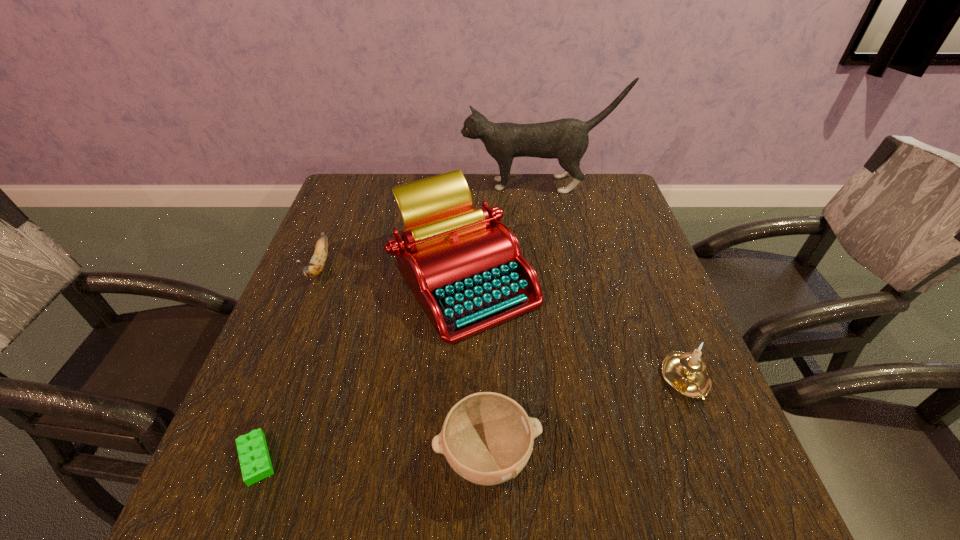
I want to click on Lego present at the left edge, so click(253, 453).

The image size is (960, 540). Identify the location of cat present at the right edge. (567, 140).

The height and width of the screenshot is (540, 960). I want to click on candle holder positioned at the right edge, so click(686, 372).

At what (x,y) coordinates should I click in order to perform the action: click on object that is at the near left corner. Please return your answer as a coordinate pair (x, y). Looking at the image, I should click on (253, 453).

The image size is (960, 540). In order to click on object positioned at the far right corner in this screenshot , I will do `click(567, 140)`.

Identify the location of free space at the far edge. Image resolution: width=960 pixels, height=540 pixels. (390, 192).

Identify the location of vacant space at the left edge of the desktop. The width and height of the screenshot is (960, 540). (329, 248).

This screenshot has width=960, height=540. I want to click on vacant space at the right edge of the desktop, so click(x=704, y=404).

Locate an element on the screen. free location at the far left corner is located at coordinates (346, 213).

Where is `free spot between the banana and the second tallest object`? free spot between the banana and the second tallest object is located at coordinates (393, 273).